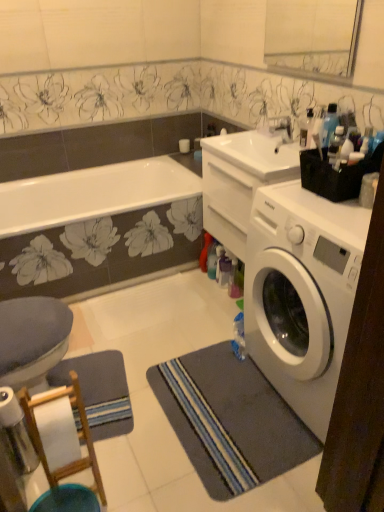
Find the location of a particular element. The height and width of the screenshot is (512, 384). free spot above blue striped yoga mat at lower left (from a real-world perspective) is located at coordinates (104, 393).